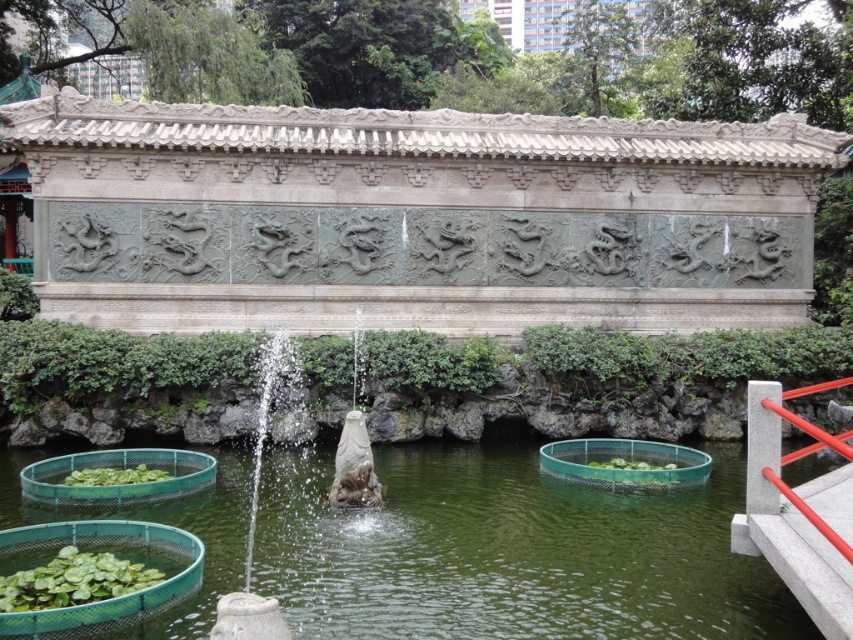
Question: Can you confirm if green water at fountain center is positioned above sandy stone fountain at center?

Choices:
 (A) no
 (B) yes

Answer: (A)

Question: Does green water at fountain center have a larger size compared to sandy stone fountain at center?

Choices:
 (A) no
 (B) yes

Answer: (B)

Question: Is green water at fountain center positioned at the back of sandy stone fountain at center?

Choices:
 (A) no
 (B) yes

Answer: (A)

Question: Which point appears closest to the camera in this image?

Choices:
 (A) (343, 436)
 (B) (136, 440)

Answer: (A)